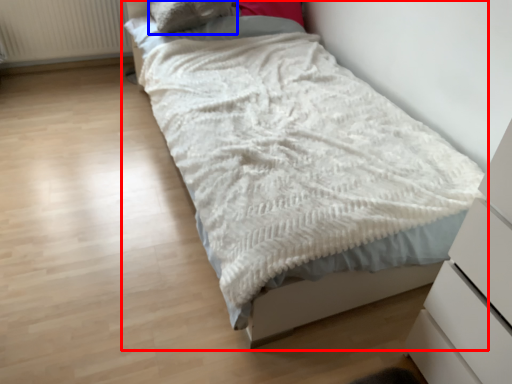
Question: Which object is closer to the camera taking this photo, bed (highlighted by a red box) or pillow (highlighted by a blue box)?

Choices:
 (A) bed
 (B) pillow

Answer: (A)